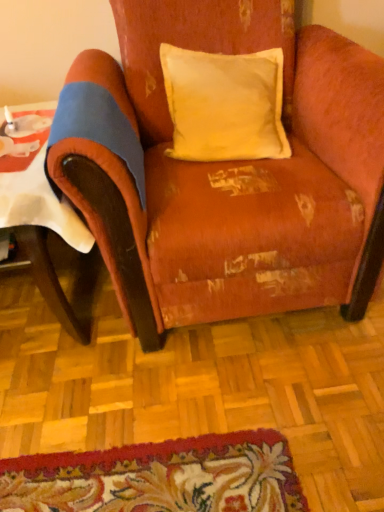
The image size is (384, 512). Describe the element at coordinates (43, 220) in the screenshot. I see `white paper at left` at that location.

Measure the distance between worn velvet armchair at center and camera.

worn velvet armchair at center is 34.00 inches away from camera.

The height and width of the screenshot is (512, 384). I want to click on white paper at left, so click(43, 220).

Considering the relative positions of worn velvet armchair at center and white paper at left in the image provided, is worn velvet armchair at center to the left or to the right of white paper at left?

worn velvet armchair at center is positioned on white paper at left's right side.

From the image's perspective, does worn velvet armchair at center appear lower than white paper at left?

Actually, worn velvet armchair at center appears above white paper at left in the image.

How different are the orientations of worn velvet armchair at center and white paper at left in degrees?

The facing directions of worn velvet armchair at center and white paper at left are 2.26 degrees apart.

Is worn velvet armchair at center wider or thinner than white paper at left?

worn velvet armchair at center is wider than white paper at left.

How far apart are yellow velvet pillow at upper center and worn velvet armchair at center?

A distance of 7.10 inches exists between yellow velvet pillow at upper center and worn velvet armchair at center.

Is yellow velvet pillow at upper center looking in the opposite direction of worn velvet armchair at center?

Correct, yellow velvet pillow at upper center is looking away from worn velvet armchair at center.

The image size is (384, 512). I want to click on chair that appears below the yellow velvet pillow at upper center (from a real-world perspective), so click(x=232, y=175).

Is point (180, 156) closer to viewer compared to point (135, 279)?

No, (180, 156) is further to viewer.

Based on their sizes in the image, would you say white paper at left is bigger or smaller than yellow velvet pillow at upper center?

In the image, white paper at left appears to be larger than yellow velvet pillow at upper center.

Is point (39, 193) positioned behind point (283, 130)?

No, it is not.

How much distance is there between white paper at left and yellow velvet pillow at upper center?

white paper at left and yellow velvet pillow at upper center are 51.45 centimeters apart from each other.

Which is more to the left, white paper at left or yellow velvet pillow at upper center?

white paper at left.

Can we say white paper at left lies outside worn velvet armchair at center?

Indeed, white paper at left is completely outside worn velvet armchair at center.

Is white paper at left to the left of worn velvet armchair at center from the viewer's perspective?

Yes, white paper at left is to the left of worn velvet armchair at center.

Is white paper at left facing towards worn velvet armchair at center?

No.

Is worn velvet armchair at center not within yellow velvet pillow at upper center?

Absolutely, worn velvet armchair at center is external to yellow velvet pillow at upper center.

Is the depth of worn velvet armchair at center greater than that of yellow velvet pillow at upper center?

Answer: No, it is in front of yellow velvet pillow at upper center.

Considering the sizes of objects worn velvet armchair at center and yellow velvet pillow at upper center in the image provided, who is smaller, worn velvet armchair at center or yellow velvet pillow at upper center?

Smaller between the two is yellow velvet pillow at upper center.

Is yellow velvet pillow at upper center bigger than white paper at left?

No, yellow velvet pillow at upper center is not bigger than white paper at left.

Which is more distant, (x=245, y=118) or (x=37, y=149)?

The point (x=245, y=118) is farther.

Measure the distance between yellow velvet pillow at upper center and white paper at left.

yellow velvet pillow at upper center and white paper at left are 20.26 inches apart from each other.

Where is `table below the worn velvet armchair at center (from the image's perspective)`? table below the worn velvet armchair at center (from the image's perspective) is located at coordinates point(43,220).

Locate an element on the screen. This screenshot has height=512, width=384. pillow on the left of worn velvet armchair at center is located at coordinates pyautogui.click(x=225, y=104).

Which object lies further to the anchor point worn velvet armchair at center, yellow velvet pillow at upper center or white paper at left?

The object further to worn velvet armchair at center is white paper at left.

Which object lies nearer to the anchor point yellow velvet pillow at upper center, worn velvet armchair at center or white paper at left?

The object closer to yellow velvet pillow at upper center is worn velvet armchair at center.

Which object lies nearer to the anchor point worn velvet armchair at center, white paper at left or yellow velvet pillow at upper center?

Based on the image, yellow velvet pillow at upper center appears to be nearer to worn velvet armchair at center.

Considering their positions, is yellow velvet pillow at upper center positioned closer to white paper at left than worn velvet armchair at center?

Among the two, worn velvet armchair at center is located nearer to white paper at left.

Looking at the image, which one is located further to white paper at left, worn velvet armchair at center or yellow velvet pillow at upper center?

Among the two, yellow velvet pillow at upper center is located further to white paper at left.

Based on their spatial positions, is white paper at left or worn velvet armchair at center closer to yellow velvet pillow at upper center?

worn velvet armchair at center.

At what (x,y) coordinates should I click in order to perform the action: click on pillow located between white paper at left and worn velvet armchair at center in the left-right direction. Please return your answer as a coordinate pair (x, y). Looking at the image, I should click on (225, 104).